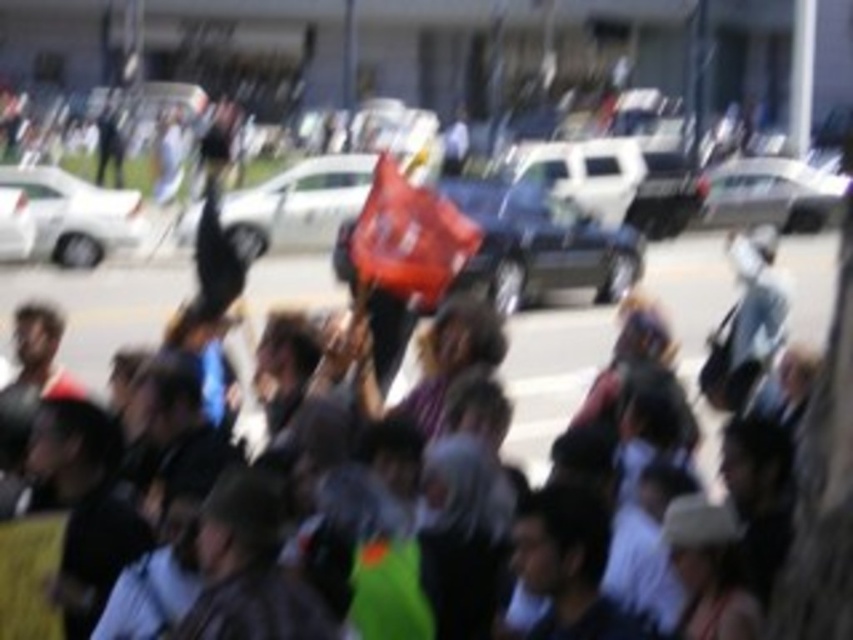
Can you confirm if matte white car at center is positioned below white matte car at left?

No, matte white car at center is not below white matte car at left.

Who is taller, matte white car at center or white matte car at left?

white matte car at left is taller.

Is point (332, 204) closer to camera compared to point (68, 250)?

That is False.

Find the location of a particular element. matte white car at center is located at coordinates (300, 202).

Can you confirm if metallic silver car at center is bigger than white matte car at left?

Correct, metallic silver car at center is larger in size than white matte car at left.

Based on the photo, does metallic silver car at center appear over white matte car at left?

No, metallic silver car at center is not above white matte car at left.

The image size is (853, 640). Find the location of `metallic silver car at center`. metallic silver car at center is located at coordinates (541, 246).

I want to click on metallic silver car at center, so click(x=541, y=246).

Can you confirm if white matte car at left is wider than white glossy sedan at upper right?

Yes, white matte car at left is wider than white glossy sedan at upper right.

Is white matte car at left to the left of white glossy sedan at upper right from the viewer's perspective?

Correct, you'll find white matte car at left to the left of white glossy sedan at upper right.

I want to click on white matte car at left, so pos(74,214).